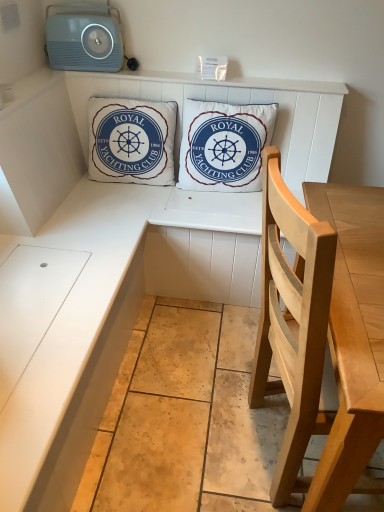
Question: Considering the relative positions of white cotton cushion at center, the first pillow in the right-to-left sequence, and white cotton cushion at center, marked as the 1th pillow in a left-to-right arrangement, in the image provided, is white cotton cushion at center, the first pillow in the right-to-left sequence, behind white cotton cushion at center, marked as the 1th pillow in a left-to-right arrangement,?

Choices:
 (A) yes
 (B) no

Answer: (B)

Question: Is white cotton cushion at center, the first pillow in the right-to-left sequence, outside of white cotton cushion at center, marked as the 1th pillow in a left-to-right arrangement?

Choices:
 (A) no
 (B) yes

Answer: (B)

Question: From the image's perspective, is white cotton cushion at center, the second pillow viewed from the left, on top of white cotton cushion at center, which ranks as the 2th pillow in right-to-left order?

Choices:
 (A) no
 (B) yes

Answer: (A)

Question: Does white cotton cushion at center, the first pillow in the right-to-left sequence, have a greater height compared to white cotton cushion at center, which ranks as the 2th pillow in right-to-left order?

Choices:
 (A) yes
 (B) no

Answer: (B)

Question: Does white cotton cushion at center, the second pillow viewed from the left, have a smaller size compared to white cotton cushion at center, which ranks as the 2th pillow in right-to-left order?

Choices:
 (A) no
 (B) yes

Answer: (A)

Question: Does white cotton cushion at center, the first pillow in the right-to-left sequence, appear on the left side of white cotton cushion at center, which ranks as the 2th pillow in right-to-left order?

Choices:
 (A) yes
 (B) no

Answer: (B)

Question: Is light wood chair at right completely or partially inside light blue plastic stereo at upper left?

Choices:
 (A) yes
 (B) no

Answer: (B)

Question: Is light blue plastic stereo at upper left oriented away from light wood chair at right?

Choices:
 (A) no
 (B) yes

Answer: (A)

Question: From the image's perspective, would you say light blue plastic stereo at upper left is positioned over light wood chair at right?

Choices:
 (A) no
 (B) yes

Answer: (B)

Question: Can you confirm if light blue plastic stereo at upper left is bigger than light wood chair at right?

Choices:
 (A) no
 (B) yes

Answer: (A)

Question: Is light blue plastic stereo at upper left smaller than light wood chair at right?

Choices:
 (A) yes
 (B) no

Answer: (A)

Question: Can you confirm if light blue plastic stereo at upper left is taller than light wood chair at right?

Choices:
 (A) yes
 (B) no

Answer: (B)

Question: Does white cotton cushion at center, the second pillow viewed from the left, have a smaller size compared to light wood chair at right?

Choices:
 (A) no
 (B) yes

Answer: (B)